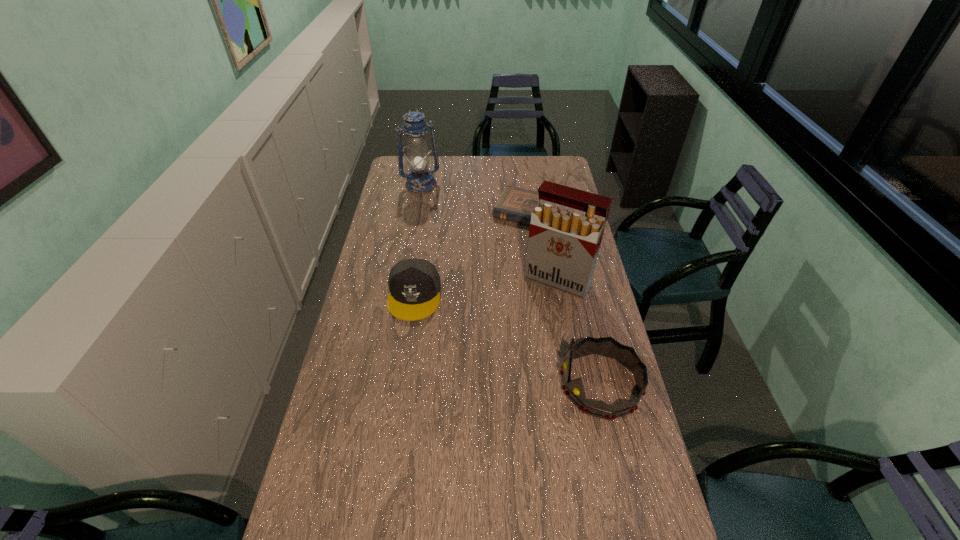
Find the location of `cap`. cap is located at coordinates (414, 284).

This screenshot has height=540, width=960. I want to click on the third shortest object, so click(x=574, y=390).

This screenshot has width=960, height=540. Identify the location of tiara. (574, 390).

Identify the location of cigarette case. Image resolution: width=960 pixels, height=540 pixels. (566, 229).

At what (x,y) coordinates should I click in order to perform the action: click on the farthest object. Please return your answer as a coordinate pair (x, y). Looking at the image, I should click on (419, 180).

Locate an element on the screen. the shortest object is located at coordinates (515, 204).

The height and width of the screenshot is (540, 960). I want to click on the second farthest object, so click(515, 204).

At what (x,y) coordinates should I click in order to perform the action: click on vacant area situated on the front-facing side of the cap. Please return your answer as a coordinate pair (x, y). Image resolution: width=960 pixels, height=540 pixels. Looking at the image, I should click on (396, 414).

Where is `free space located at the front of the tiara with jewels`? This screenshot has height=540, width=960. free space located at the front of the tiara with jewels is located at coordinates (474, 384).

The height and width of the screenshot is (540, 960). Identify the location of free spot located at the front of the tiara with jewels. (464, 384).